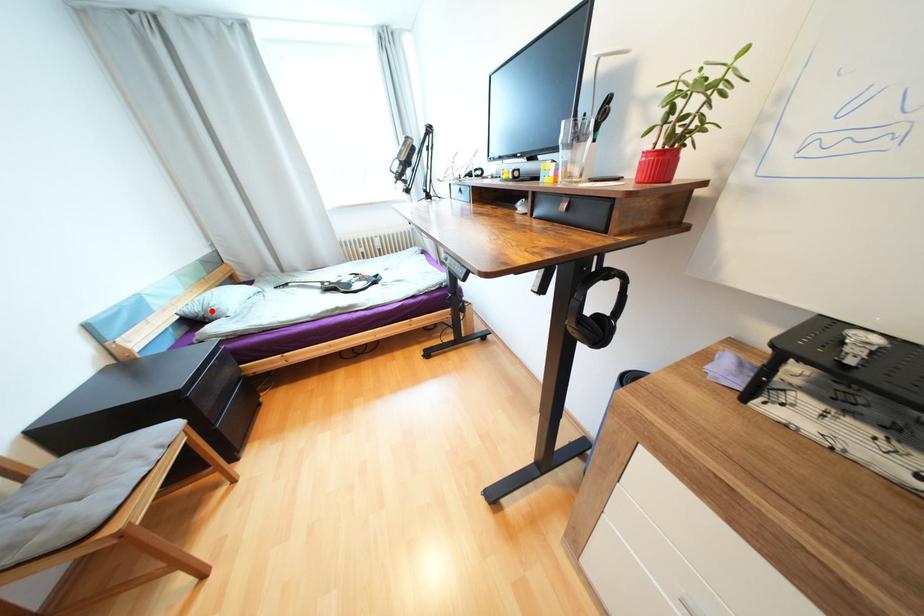
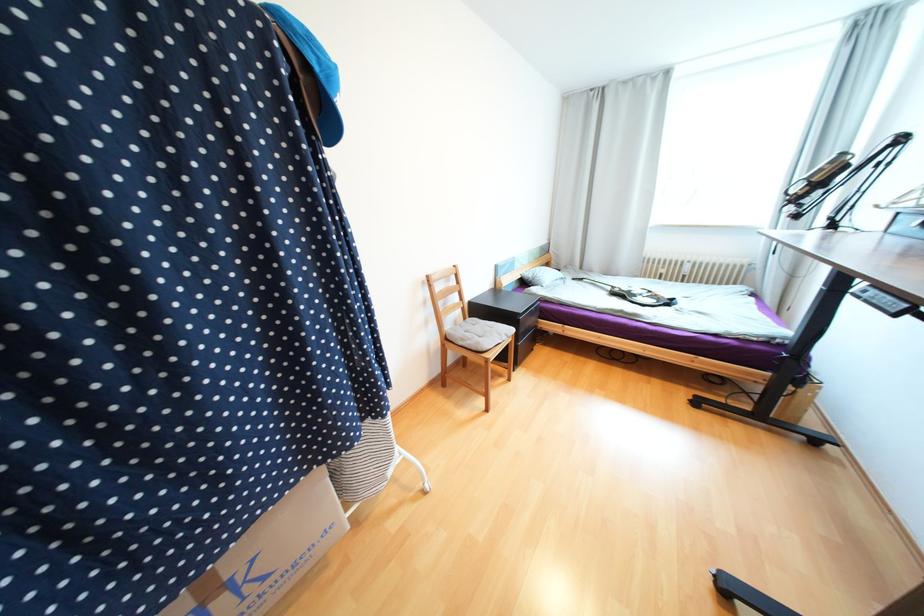
Find the pixel in the second image that matches the highlighted location in the first image.

(540, 278)